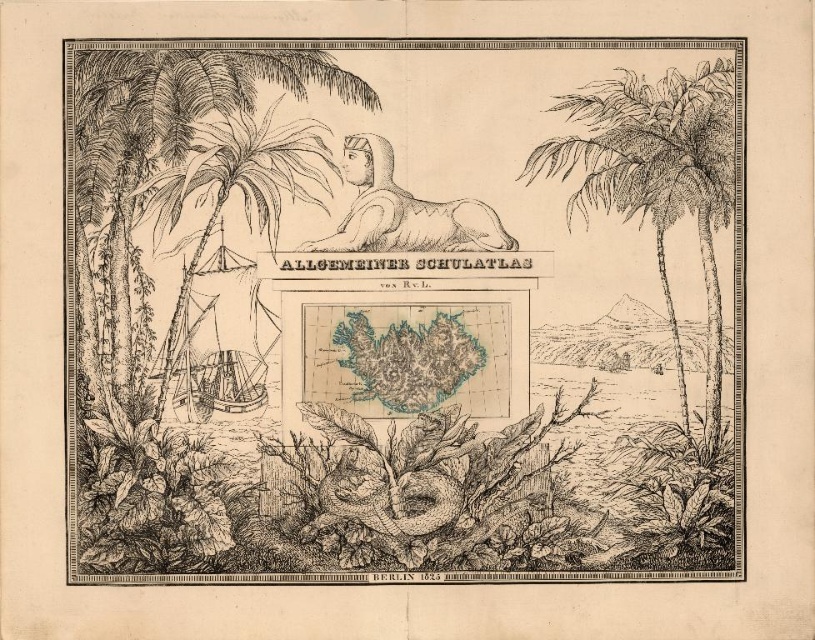
Consider the image. Who is shorter, black ink palm tree at right or smooth beige statue at center?

Standing shorter between the two is smooth beige statue at center.

Does black ink palm tree at right appear over smooth beige statue at center?

Incorrect, black ink palm tree at right is not positioned above smooth beige statue at center.

Does point (644, 96) come in front of point (344, 157)?

No, it is behind (344, 157).

Identify the location of black ink palm tree at right. (657, 179).

Between blue ink map at center and smooth beige statue at center, which one has less height?

smooth beige statue at center

Is blue ink map at center thinner than smooth beige statue at center?

Incorrect, blue ink map at center's width is not less than smooth beige statue at center's.

Is point (368, 93) behind point (481, 205)?

No.

Find the location of a particular element. blue ink map at center is located at coordinates click(403, 308).

This screenshot has width=815, height=640. What do you see at coordinates (403, 308) in the screenshot?
I see `blue ink map at center` at bounding box center [403, 308].

Measure the distance between blue ink map at center and camera.

blue ink map at center and camera are 42.92 feet apart from each other.

Image resolution: width=815 pixels, height=640 pixels. In order to click on blue ink map at center in this screenshot , I will do `click(403, 308)`.